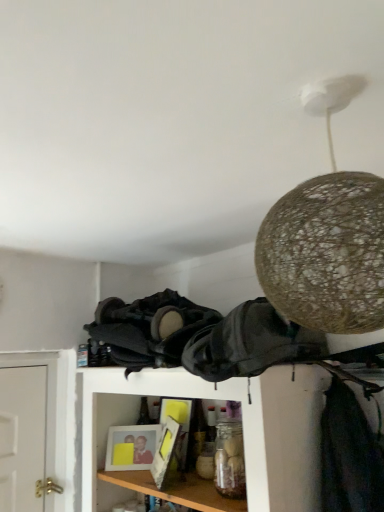
Question: From the image's perspective, would you say matte plastic picture frame at lower center is shown under black fabric at center, which is the first clothing from left to right?

Choices:
 (A) yes
 (B) no

Answer: (A)

Question: Does matte plastic picture frame at lower center have a larger size compared to black fabric at center, which is the first clothing from left to right?

Choices:
 (A) yes
 (B) no

Answer: (B)

Question: Considering the relative positions of matte plastic picture frame at lower center and black fabric at center, which is the first clothing from left to right, in the image provided, is matte plastic picture frame at lower center to the right of black fabric at center, which is the first clothing from left to right, from the viewer's perspective?

Choices:
 (A) no
 (B) yes

Answer: (A)

Question: Can you confirm if matte plastic picture frame at lower center is taller than black fabric at center, acting as the second clothing starting from the right?

Choices:
 (A) no
 (B) yes

Answer: (A)

Question: Considering the relative sizes of matte plastic picture frame at lower center and black fabric at center, acting as the second clothing starting from the right, in the image provided, is matte plastic picture frame at lower center shorter than black fabric at center, acting as the second clothing starting from the right,?

Choices:
 (A) no
 (B) yes

Answer: (B)

Question: Is matte plastic picture frame at lower center next to black fabric at center, acting as the second clothing starting from the right, and touching it?

Choices:
 (A) yes
 (B) no

Answer: (B)

Question: Is black leather backpack at center, which is the second clothing in left-to-right order, positioned far away from matte plastic picture frame at lower center?

Choices:
 (A) yes
 (B) no

Answer: (B)

Question: From a real-world perspective, is black leather backpack at center, which is the second clothing in left-to-right order, on matte plastic picture frame at lower center?

Choices:
 (A) yes
 (B) no

Answer: (A)

Question: Is black leather backpack at center, which is the second clothing in left-to-right order, beside matte plastic picture frame at lower center?

Choices:
 (A) yes
 (B) no

Answer: (B)

Question: Can you confirm if black leather backpack at center, which ranks as the 1th clothing in right-to-left order, is bigger than matte plastic picture frame at lower center?

Choices:
 (A) yes
 (B) no

Answer: (A)

Question: From the image's perspective, would you say black leather backpack at center, which ranks as the 1th clothing in right-to-left order, is shown under matte plastic picture frame at lower center?

Choices:
 (A) no
 (B) yes

Answer: (A)

Question: Would you say matte plastic picture frame at lower center is part of black leather backpack at center, which ranks as the 1th clothing in right-to-left order,'s contents?

Choices:
 (A) yes
 (B) no

Answer: (B)

Question: Can you confirm if black leather backpack at center, which ranks as the 1th clothing in right-to-left order, is positioned to the left of black fabric at center, which is the first clothing from left to right?

Choices:
 (A) no
 (B) yes

Answer: (A)